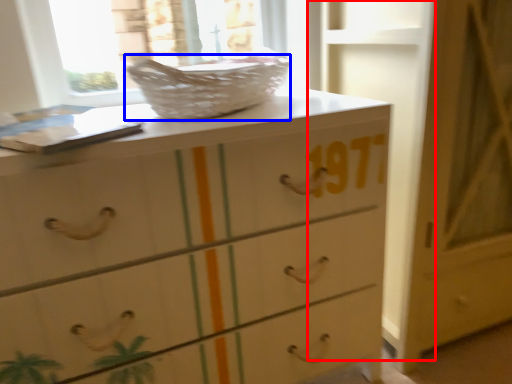
Question: Which object appears closest to the camera in this image, door (highlighted by a red box) or basket (highlighted by a blue box)?

Choices:
 (A) door
 (B) basket

Answer: (B)